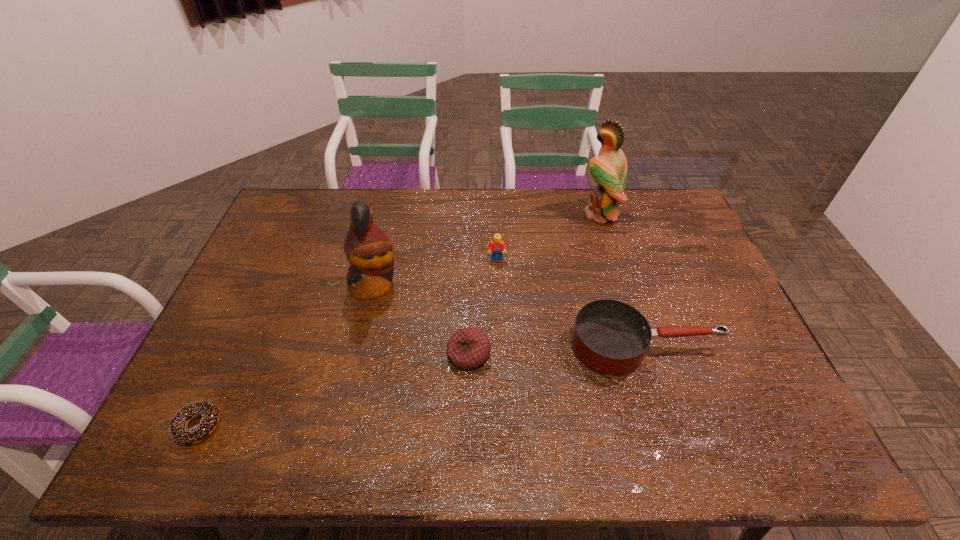
The height and width of the screenshot is (540, 960). I want to click on free space that satisfies the following two spatial constraints: 1. on the face of the beanbag; 2. on the right side of the left parrot, so click(358, 354).

Where is `free space that satisfies the following two spatial constraints: 1. on the face of the second farthest object; 2. on the face of the left parrot`? Image resolution: width=960 pixels, height=540 pixels. free space that satisfies the following two spatial constraints: 1. on the face of the second farthest object; 2. on the face of the left parrot is located at coordinates (498, 285).